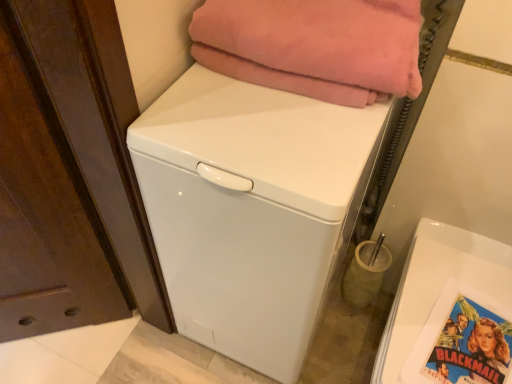
Identify the location of vacant region to the left of blue glossy comic book at lower right. (410, 340).